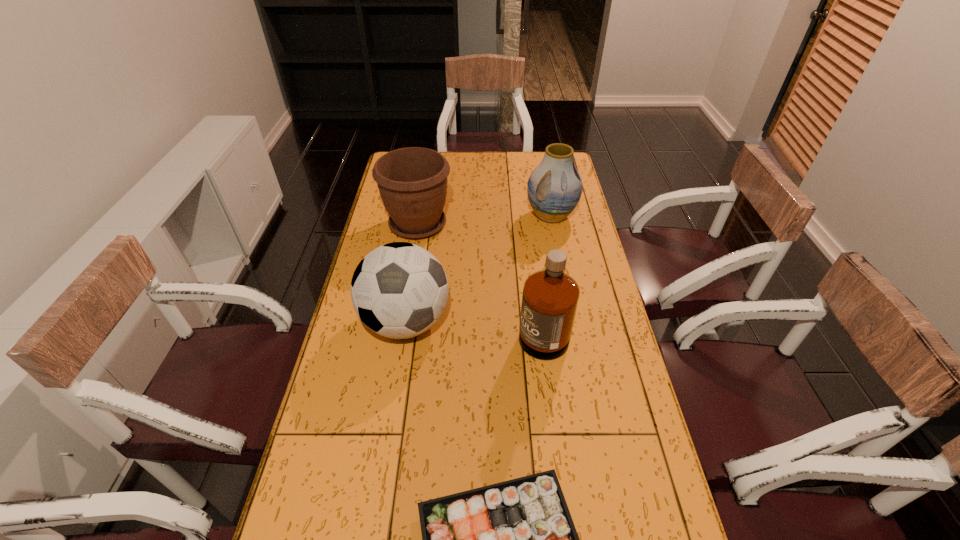
This screenshot has height=540, width=960. Identify the location of free space between the soccer ball and the liquor. (474, 323).

Identify the location of free area in between the flowerpot and the vase. The image size is (960, 540). (485, 220).

I want to click on free space between the liquor and the flowerpot, so click(480, 275).

Identify which object is the closest to the soccer ball. Please provide its 2D coordinates. Your answer should be formatted as a tuple, i.e. [(x, y)], where the tuple contains the x and y coordinates of a point satisfying the conditions above.

[(550, 297)]

Find the location of a particular element. object identified as the closest to the platter is located at coordinates (550, 297).

This screenshot has height=540, width=960. Identify the location of vacant position in the image that satisfies the following two spatial constraints: 1. on the front side of the vase; 2. on the front label of the liquor. (572, 326).